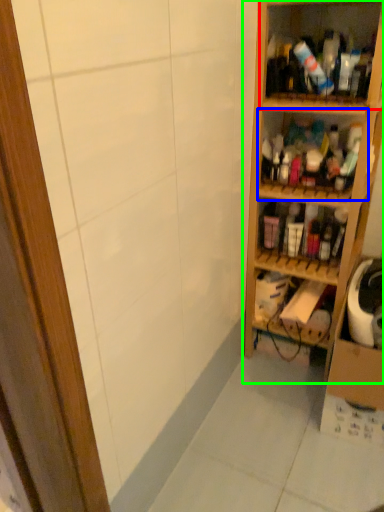
Question: Which is farther away from shelf (highlighted by a red box)? shelf (highlighted by a blue box) or shelf (highlighted by a green box)?

Choices:
 (A) shelf
 (B) shelf

Answer: (A)